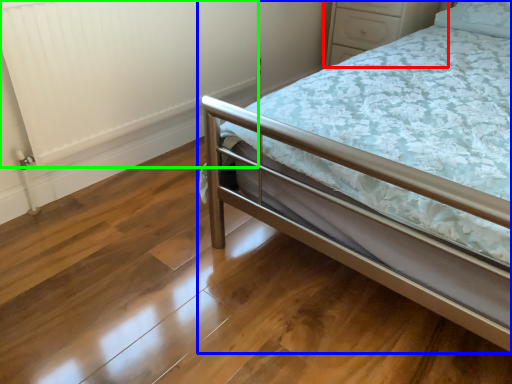
Question: Which object is positioned closest to dresser (highlighted by a red box)? Select from bed (highlighted by a blue box) and radiator (highlighted by a green box).

Choices:
 (A) bed
 (B) radiator

Answer: (B)